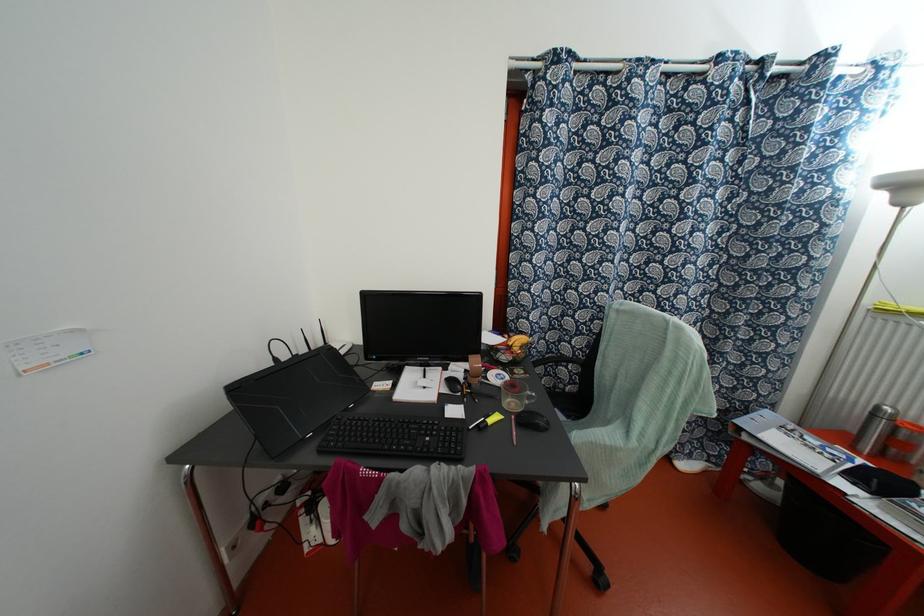
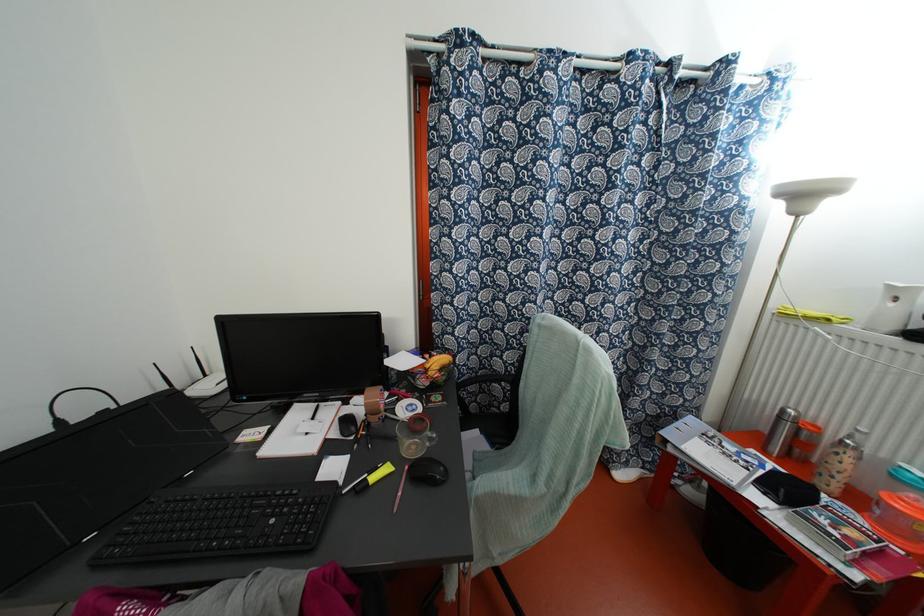
Question: The camera is either moving clockwise (left) or counter-clockwise (right) around the object. The first image is from the beginning of the video and the second image is from the end. Is the camera moving left or right when shooting the video?

Choices:
 (A) Left
 (B) Right

Answer: (A)